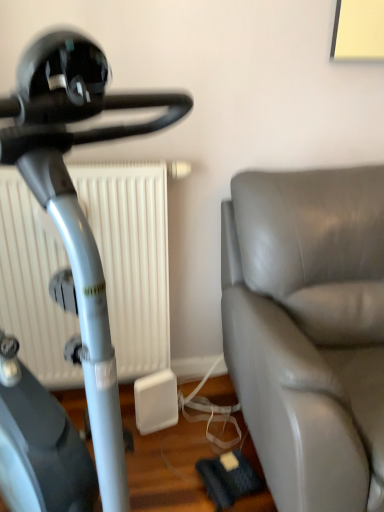
Question: Considering the positions of gray leather couch at right and matte black stationary bicycle at left in the image, is gray leather couch at right wider or thinner than matte black stationary bicycle at left?

Choices:
 (A) wide
 (B) thin

Answer: (A)

Question: Does point (321, 364) appear closer or farther from the camera than point (18, 138)?

Choices:
 (A) closer
 (B) farther

Answer: (B)

Question: Which object is the closest to the gray leather couch at right?

Choices:
 (A) white matte radiator at center
 (B) matte black stationary bicycle at left

Answer: (A)

Question: Considering the real-world distances, which object is farthest from the matte black stationary bicycle at left?

Choices:
 (A) gray leather couch at right
 (B) white matte radiator at center

Answer: (B)